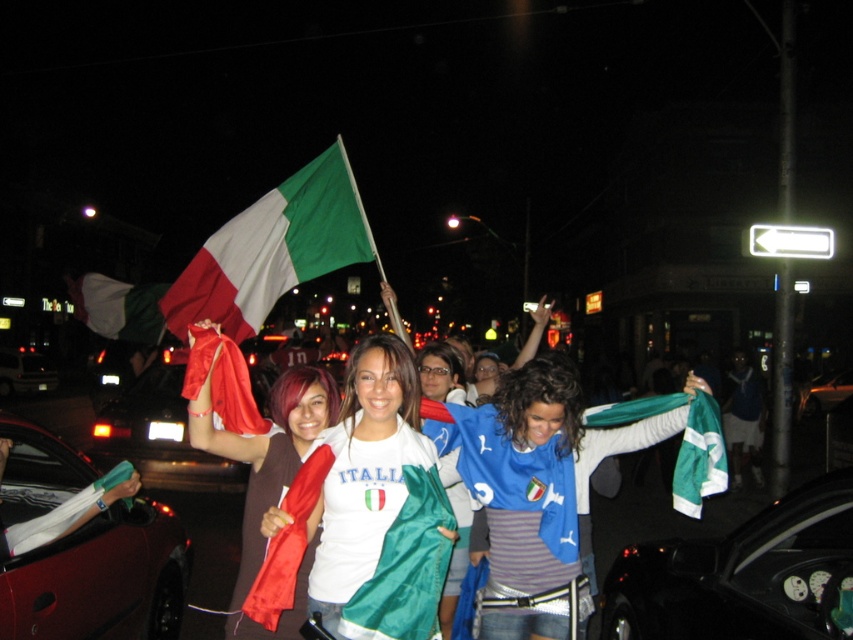
You are a photographer standing in the middle of the street. You want to take a photo of the white matte shirt at center and the black leather car at lower right. However, there is a light pole between them. Which object is closer to you so that you can focus on it first?

The white matte shirt at center is closer to you than the black leather car at lower right, so you can focus on it first.

You are a photographer trying to capture a photo of the blue jersey at center and the shiny red scarf at center. Which object should you focus on first if you want to include both in the frame without zooming in or out?

The blue jersey at center is larger in size than the shiny red scarf at center, so you should focus on the blue jersey at center first to ensure it fits properly in the frame before adjusting for the smaller shiny red scarf at center.

You are a photographer standing at the edge of the street. You want to take a photo of the white matte shirt at center without the black leather car at lower right blocking it. Where should you move to achieve this?

To avoid the black leather car at lower right blocking the white matte shirt at center, you should move to a position where the white matte shirt at center is no longer behind the black leather car at lower right. Since the white matte shirt at center is currently behind the black leather car at lower right, moving to the left or right side of the car would allow you to capture the shirt without obstruction.